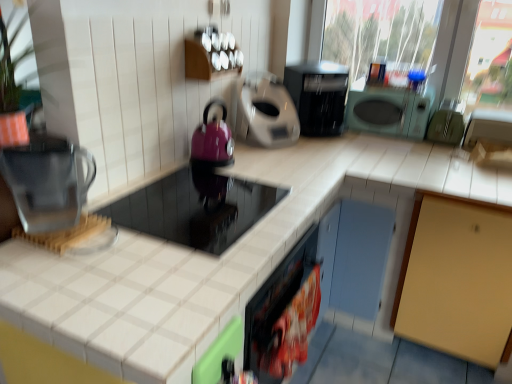
Where is `blank space situated above white tile countertop at center (from a real-world perspective)`? This screenshot has width=512, height=384. blank space situated above white tile countertop at center (from a real-world perspective) is located at coordinates (177, 231).